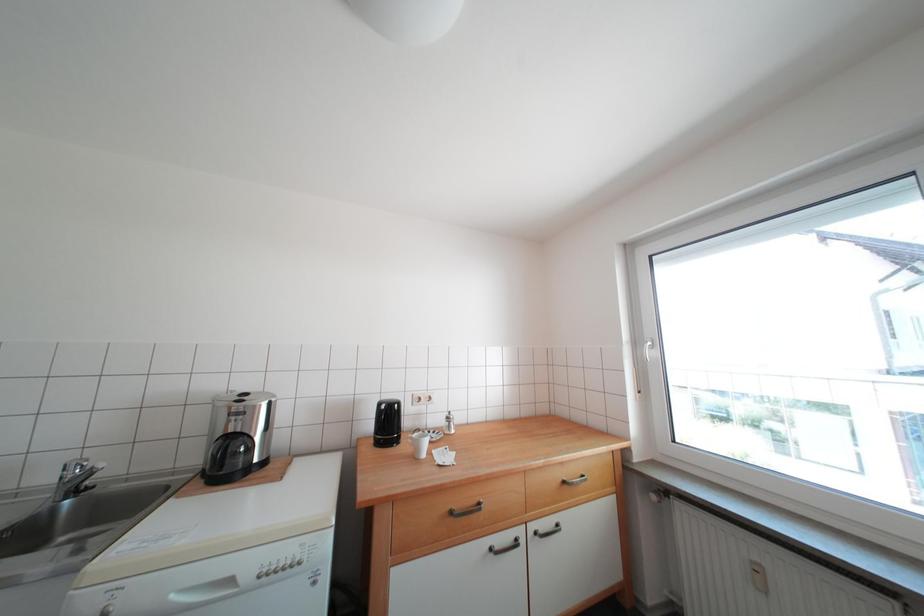
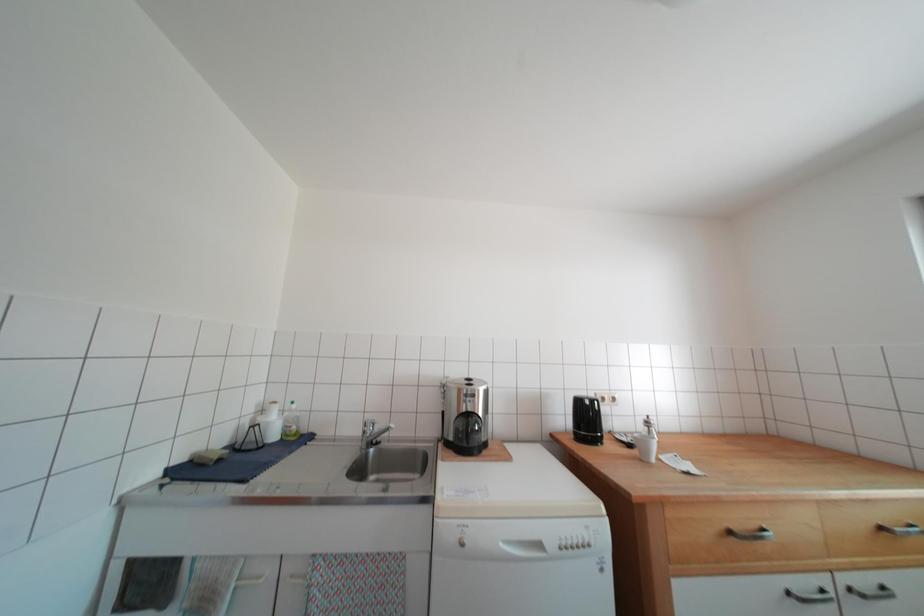
Question: In a continuous first-person perspective shot, in which direction is the camera moving?

Choices:
 (A) Left
 (B) Right
 (C) Forward
 (D) Backward

Answer: (A)